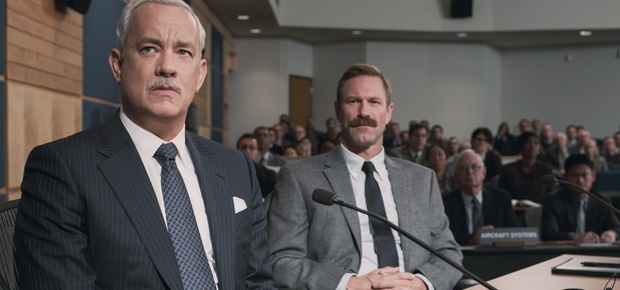
The height and width of the screenshot is (290, 620). Identify the location of pen. (596, 267).